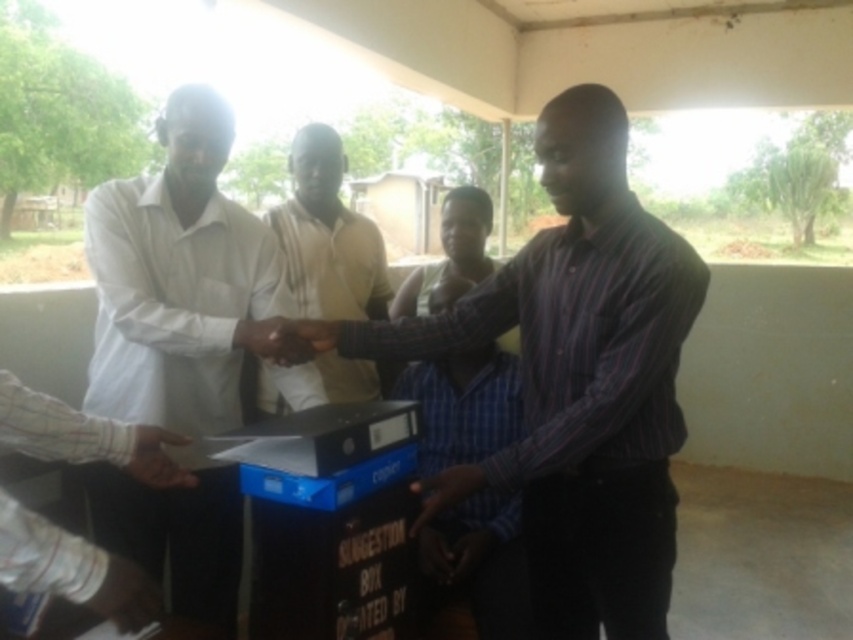
The width and height of the screenshot is (853, 640). What are the coordinates of `matte black hand at lower left` in the screenshot? It's located at (126, 595).

Can you confirm if matte black hand at lower left is wider than matte brown hand at center?

No.

What do you see at coordinates (126, 595) in the screenshot?
I see `matte black hand at lower left` at bounding box center [126, 595].

Identify the location of matte black hand at lower left. (126, 595).

Measure the distance between light brown fabric shirt at center and camera.

light brown fabric shirt at center is 1.76 meters from camera.

Is light brown fabric shirt at center thinner than white matte hand at center?

No.

Measure the distance between light brown fabric shirt at center and camera.

light brown fabric shirt at center is 5.76 feet from camera.

Where is `light brown fabric shirt at center`? light brown fabric shirt at center is located at coordinates (328, 236).

Who is lower down, matte brown hand at center or matte black hand at lower center?

matte black hand at lower center is lower down.

Between point (268, 324) and point (431, 496), which one is positioned in front?

Point (431, 496)

This screenshot has width=853, height=640. Describe the element at coordinates (271, 340) in the screenshot. I see `matte brown hand at center` at that location.

Identify the location of matte brown hand at center. (271, 340).